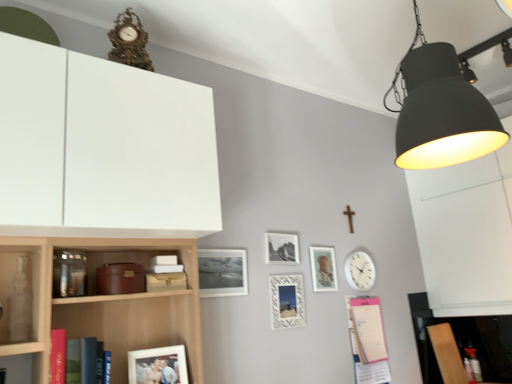
Question: Is pink paper notepad at lower right, marked as the second book in a left-to-right arrangement, outside hardcover book at left, which is counted as the first book, starting from the top?

Choices:
 (A) no
 (B) yes

Answer: (B)

Question: From a real-world perspective, is pink paper notepad at lower right, which appears as the 1th book when viewed from the right, positioned under hardcover book at left, which is the first book in front-to-back order, based on gravity?

Choices:
 (A) yes
 (B) no

Answer: (A)

Question: Considering the relative sizes of pink paper notepad at lower right, marked as the second book in a left-to-right arrangement, and hardcover book at left, the second book from the back, in the image provided, is pink paper notepad at lower right, marked as the second book in a left-to-right arrangement, wider than hardcover book at left, the second book from the back,?

Choices:
 (A) yes
 (B) no

Answer: (B)

Question: Is pink paper notepad at lower right, which is the first book from bottom to top, closer to camera compared to hardcover book at left, which is the first book in front-to-back order?

Choices:
 (A) no
 (B) yes

Answer: (A)

Question: From a real-world perspective, is pink paper notepad at lower right, which is the 1th book from back to front, located higher than hardcover book at left, which is the first book in front-to-back order?

Choices:
 (A) no
 (B) yes

Answer: (A)

Question: In the image, is white plastic clock at upper right, positioned as the first clock in bottom-to-top order, on the left side or the right side of white matte cabinet at upper left?

Choices:
 (A) left
 (B) right

Answer: (B)

Question: Is white plastic clock at upper right, the second clock in the front-to-back sequence, taller or shorter than white matte cabinet at upper left?

Choices:
 (A) short
 (B) tall

Answer: (A)

Question: Considering their positions, is white plastic clock at upper right, the first clock viewed from the back, located in front of or behind white matte cabinet at upper left?

Choices:
 (A) front
 (B) behind

Answer: (B)

Question: From the image's perspective, is white plastic clock at upper right, the second clock in the left-to-right sequence, above or below white matte cabinet at upper left?

Choices:
 (A) above
 (B) below

Answer: (B)

Question: Is metallic silver frame at center, the 3th picture frame in the left-to-right sequence, taller or shorter than matte black lampshade at upper right?

Choices:
 (A) short
 (B) tall

Answer: (A)

Question: In the image, is metallic silver frame at center, positioned as the fourth picture frame in front-to-back order, positioned in front of or behind matte black lampshade at upper right?

Choices:
 (A) front
 (B) behind

Answer: (B)

Question: Is metallic silver frame at center, the 3th picture frame when ordered from right to left, inside or outside of matte black lampshade at upper right?

Choices:
 (A) outside
 (B) inside

Answer: (A)

Question: From a real-world perspective, is metallic silver frame at center, the 3th picture frame in the left-to-right sequence, physically located above or below matte black lampshade at upper right?

Choices:
 (A) above
 (B) below

Answer: (B)

Question: From the image's perspective, is hardcover book at left, which is counted as the first book, starting from the top, above or below gold ornate clock at upper center, acting as the 1th clock starting from the front?

Choices:
 (A) below
 (B) above

Answer: (A)

Question: In the image, is hardcover book at left, the second book from the back, on the left side or the right side of gold ornate clock at upper center, the 2th clock from the right?

Choices:
 (A) right
 (B) left

Answer: (B)